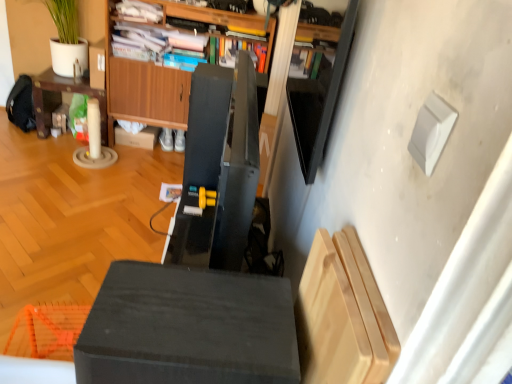
Locate an element on the screen. The image size is (512, 384). brown cardboard box at center is located at coordinates coord(137,137).

What is the approximate height of matte brown table at left?

It is 18.46 inches.

I want to click on wooden cabinet at center, so click(146, 93).

Is matte black cube at center bigger or smaller than wooden cabinet at center?

Considering their sizes, matte black cube at center takes up less space than wooden cabinet at center.

Which object is positioned more to the right, matte black cube at center or wooden cabinet at center?

matte black cube at center.

Considering the sizes of objects matte black cube at center and wooden cabinet at center in the image provided, who is taller, matte black cube at center or wooden cabinet at center?

Standing taller between the two is wooden cabinet at center.

You are a GUI agent. You are given a task and a screenshot of the screen. Output one action in this format:
    pyautogui.click(x=<x>, y=<y>)
    Task: Click on the cabinetry that appears behind the matte black cube at center
    
    Given the screenshot: What is the action you would take?
    pyautogui.click(x=146, y=93)

Is wooden cabinet at center spatially inside matte black cube at center, or outside of it?

The correct answer is: outside.

Does wooden cabinet at center lie in front of matte black cube at center?

No, it is not.

From the image's perspective, does wooden cabinet at center appear higher than matte black cube at center?

Yes.

Considering the sizes of objects light wood cutting board at lower right and wooden cabinet at center in the image provided, who is bigger, light wood cutting board at lower right or wooden cabinet at center?

wooden cabinet at center is bigger.

How different are the orientations of light wood cutting board at lower right and wooden cabinet at center in degrees?

91.6 degrees separate the facing orientations of light wood cutting board at lower right and wooden cabinet at center.

The height and width of the screenshot is (384, 512). In the image, there is a wooden cabinet at center. Find the location of `shelf below it (from the image's perspective)`. shelf below it (from the image's perspective) is located at coordinates (342, 315).

From the picture: Choose the correct answer: Is matte black cube at center inside light wood cutting board at lower right or outside it?

matte black cube at center is not enclosed by light wood cutting board at lower right.

Which of these two, matte black cube at center or light wood cutting board at lower right, is thinner?

Thinner between the two is light wood cutting board at lower right.

Does matte black cube at center have a greater height compared to light wood cutting board at lower right?

In fact, matte black cube at center may be shorter than light wood cutting board at lower right.

Is matte black cube at center far away from light wood cutting board at lower right?

No, matte black cube at center is not far from light wood cutting board at lower right.

Between light wood cutting board at lower right and matte brown table at left, which one has less height?

light wood cutting board at lower right is shorter.

Between light wood cutting board at lower right and matte brown table at left, which one appears on the left side from the viewer's perspective?

matte brown table at left is more to the left.

Is light wood cutting board at lower right in front of or behind matte brown table at left in the image?

In the image, light wood cutting board at lower right appears in front of matte brown table at left.

Is light wood cutting board at lower right not near matte brown table at left?

light wood cutting board at lower right is far away from matte brown table at left.

Which is more to the left, brown cardboard box at center or matte brown table at left?

matte brown table at left is more to the left.

Based on their sizes in the image, would you say brown cardboard box at center is bigger or smaller than matte brown table at left?

Considering their sizes, brown cardboard box at center takes up less space than matte brown table at left.

Between point (126, 133) and point (44, 101), which one is positioned behind?

Point (126, 133)

The height and width of the screenshot is (384, 512). I want to click on table on the left side of matte black cube at center, so (61, 99).

How many degrees apart are the facing directions of matte black cube at center and matte brown table at left?

91.1 degrees.

How far apart are matte black cube at center and matte brown table at left?

A distance of 2.61 meters exists between matte black cube at center and matte brown table at left.

Could you tell me if matte black cube at center is facing matte brown table at left?

No, matte black cube at center does not turn towards matte brown table at left.

This screenshot has width=512, height=384. What are the coordinates of `cabinetry that appears on the left of matte black cube at center` in the screenshot? It's located at (146, 93).

Locate an element on the screen. This screenshot has height=384, width=512. furniture in front of the wooden cabinet at center is located at coordinates (188, 328).

Based on their spatial positions, is light wood cutting board at lower right or matte brown table at left closer to brown cardboard box at center?

Among the two, matte brown table at left is located nearer to brown cardboard box at center.

Which object lies nearer to the anchor point light wood cutting board at lower right, wooden cabinet at center or matte black cube at center?

The object closer to light wood cutting board at lower right is matte black cube at center.

Estimate the real-world distances between objects in this image. Which object is further from brown cardboard box at center, light wood cutting board at lower right or matte black cube at center?

Among the two, light wood cutting board at lower right is located further to brown cardboard box at center.

Based on their spatial positions, is matte brown table at left or wooden cabinet at center further from matte black cube at center?

matte brown table at left.

Based on the photo, from the image, which object appears to be farther from brown cardboard box at center, matte black cube at center or matte brown table at left?

matte black cube at center is positioned further to the anchor brown cardboard box at center.

Which object lies further to the anchor point wooden cabinet at center, matte brown table at left or matte black cube at center?

matte black cube at center is further to wooden cabinet at center.

Looking at the image, which one is located closer to matte black cube at center, matte brown table at left or light wood cutting board at lower right?

light wood cutting board at lower right.

Estimate the real-world distances between objects in this image. Which object is further from brown cardboard box at center, matte brown table at left or matte black cube at center?

Among the two, matte black cube at center is located further to brown cardboard box at center.

The height and width of the screenshot is (384, 512). Find the location of `cabinetry located between matte black cube at center and brown cardboard box at center in the depth direction`. cabinetry located between matte black cube at center and brown cardboard box at center in the depth direction is located at coordinates (146, 93).

Where is `furniture between light wood cutting board at lower right and brown cardboard box at center along the z-axis`? furniture between light wood cutting board at lower right and brown cardboard box at center along the z-axis is located at coordinates (188, 328).

Image resolution: width=512 pixels, height=384 pixels. Find the location of `table located between light wood cutting board at lower right and brown cardboard box at center in the depth direction`. table located between light wood cutting board at lower right and brown cardboard box at center in the depth direction is located at coordinates (61, 99).

You are a GUI agent. You are given a task and a screenshot of the screen. Output one action in this format:
    pyautogui.click(x=<x>, y=<y>)
    Task: Click on the cabinetry positioned between light wood cutting board at lower right and brown cardboard box at center from near to far
    This screenshot has height=384, width=512.
    Given the screenshot: What is the action you would take?
    pyautogui.click(x=146, y=93)